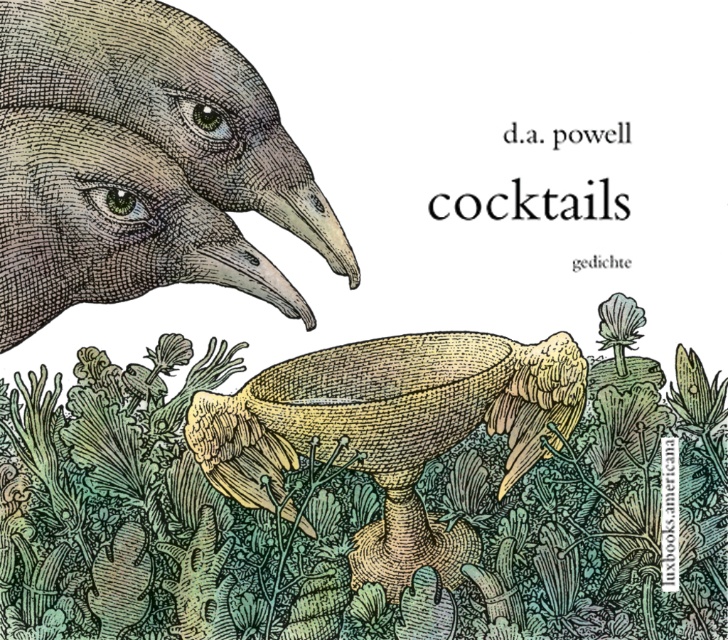
Question: Which object is positioned farthest from the yellow woven basket at center?

Choices:
 (A) green textured plant at lower center
 (B) brown textured bird head at upper left

Answer: (B)

Question: Does brown textured bird head at upper left have a larger size compared to yellow woven basket at center?

Choices:
 (A) yes
 (B) no

Answer: (A)

Question: Which point is farther to the camera?

Choices:
 (A) (637, 316)
 (B) (75, 96)

Answer: (A)

Question: Does brown textured bird head at upper left lie in front of yellow woven basket at center?

Choices:
 (A) yes
 (B) no

Answer: (A)

Question: Which of the following is the farthest from the observer?

Choices:
 (A) yellow woven basket at center
 (B) green textured plant at lower center
 (C) brown textured bird head at upper left

Answer: (B)

Question: Is green textured plant at lower center positioned before yellow woven basket at center?

Choices:
 (A) yes
 (B) no

Answer: (B)